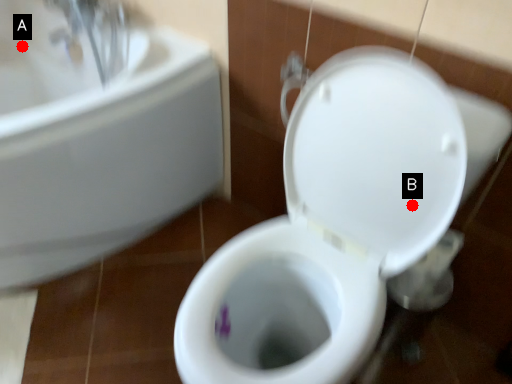
Question: Two points are circled on the image, labeled by A and B beside each circle. Which point is farther from the camera taking this photo?

Choices:
 (A) A is further
 (B) B is further

Answer: (A)